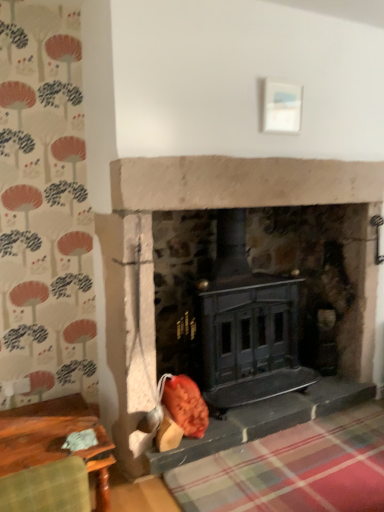
Where is `wooden table at lower left`? wooden table at lower left is located at coordinates (55, 439).

The image size is (384, 512). What do you see at coordinates (55, 439) in the screenshot? I see `wooden table at lower left` at bounding box center [55, 439].

I want to click on wooden table at lower left, so click(55, 439).